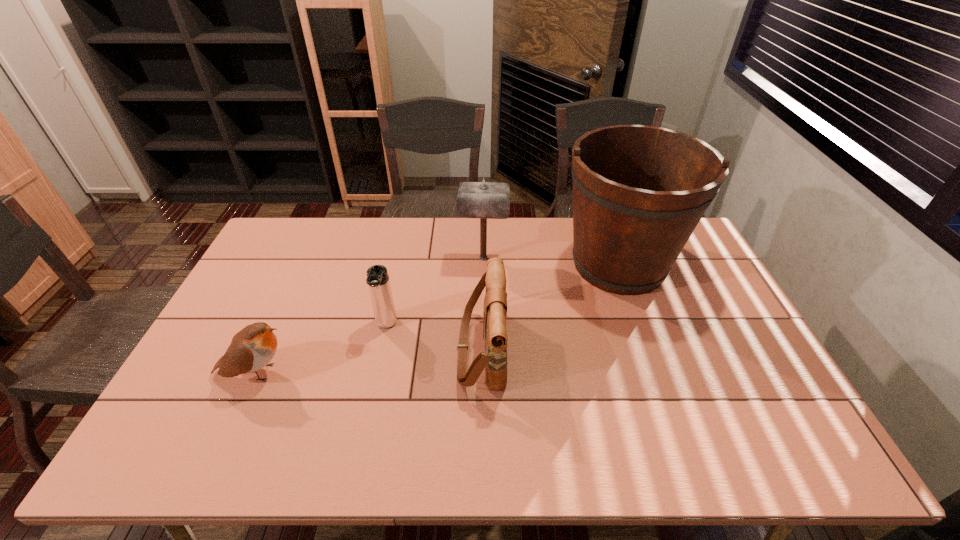
The height and width of the screenshot is (540, 960). What are the coordinates of `vacant area between the rightmost object and the shoulder bag` in the screenshot? It's located at (550, 307).

Identify which object is the second nearest to the mallet. Please provide its 2D coordinates. Your answer should be formatted as a tuple, i.e. [(x, y)], where the tuple contains the x and y coordinates of a point satisfying the conditions above.

[(494, 360)]

You are a GUI agent. You are given a task and a screenshot of the screen. Output one action in this format:
    pyautogui.click(x=<x>, y=<y>)
    Task: Click on the object that is the third closest one to the thermos bottle
    This screenshot has height=540, width=960.
    Given the screenshot: What is the action you would take?
    pyautogui.click(x=486, y=200)

This screenshot has height=540, width=960. What are the coordinates of `free space that satisfies the following two spatial constraints: 1. on the front side of the mallet; 2. at the face of the leftmost object` in the screenshot? It's located at (485, 373).

Where is `vacant space that satisfies the following two spatial constraints: 1. on the handle side of the thermos bottle; 2. at the face of the bird`? vacant space that satisfies the following two spatial constraints: 1. on the handle side of the thermos bottle; 2. at the face of the bird is located at coordinates (376, 373).